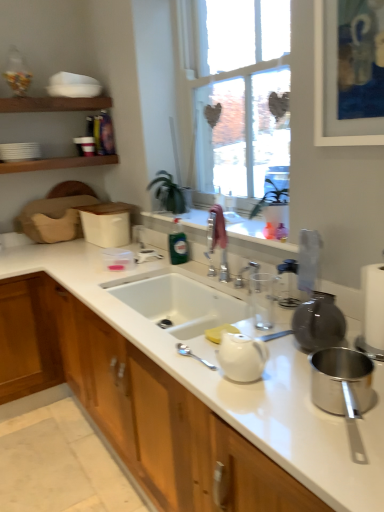
Question: Is polished stainless steel pot at lower right, arranged as the second appliance when viewed from the back, shorter than green glass bottle at center?

Choices:
 (A) no
 (B) yes

Answer: (B)

Question: From the image's perspective, is polished stainless steel pot at lower right, positioned as the first appliance in front-to-back order, located beneath green glass bottle at center?

Choices:
 (A) no
 (B) yes

Answer: (B)

Question: Is polished stainless steel pot at lower right, positioned as the first appliance in front-to-back order, at the right side of green glass bottle at center?

Choices:
 (A) no
 (B) yes

Answer: (B)

Question: Considering the relative sizes of polished stainless steel pot at lower right, positioned as the 1th appliance in bottom-to-top order, and green glass bottle at center in the image provided, is polished stainless steel pot at lower right, positioned as the 1th appliance in bottom-to-top order, taller than green glass bottle at center?

Choices:
 (A) no
 (B) yes

Answer: (A)

Question: Could you tell me if polished stainless steel pot at lower right, the second appliance viewed from the top, is facing green glass bottle at center?

Choices:
 (A) yes
 (B) no

Answer: (B)

Question: Considering the relative positions of polished stainless steel pot at lower right, positioned as the first appliance in front-to-back order, and green glass bottle at center in the image provided, is polished stainless steel pot at lower right, positioned as the first appliance in front-to-back order, to the left of green glass bottle at center from the viewer's perspective?

Choices:
 (A) no
 (B) yes

Answer: (A)

Question: Does green glass bottle at center turn towards white ceramic sink at center?

Choices:
 (A) no
 (B) yes

Answer: (A)

Question: Can you confirm if green glass bottle at center is thinner than white ceramic sink at center?

Choices:
 (A) no
 (B) yes

Answer: (B)

Question: Is green glass bottle at center positioned far away from white ceramic sink at center?

Choices:
 (A) no
 (B) yes

Answer: (A)

Question: Does green glass bottle at center have a greater height compared to white ceramic sink at center?

Choices:
 (A) yes
 (B) no

Answer: (A)

Question: Considering the relative positions of green glass bottle at center and white ceramic sink at center in the image provided, is green glass bottle at center to the right of white ceramic sink at center from the viewer's perspective?

Choices:
 (A) yes
 (B) no

Answer: (B)

Question: Does green glass bottle at center contain white ceramic sink at center?

Choices:
 (A) no
 (B) yes

Answer: (A)

Question: From the image's perspective, does clear plastic bag at upper right, which is counted as the first appliance, starting from the back, appear lower than white glossy cabinet at center?

Choices:
 (A) yes
 (B) no

Answer: (B)